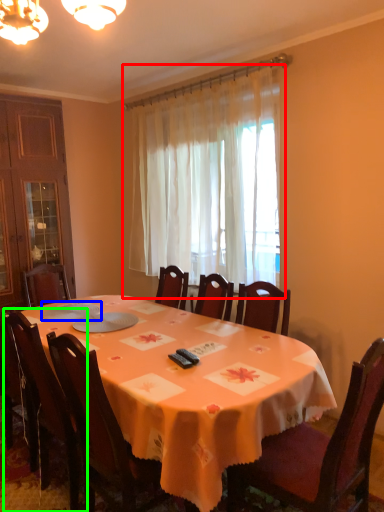
Question: Considering the real-world distances, which object is farthest from curtain (highlighted by a red box)? tableware (highlighted by a blue box) or chair (highlighted by a green box)?

Choices:
 (A) tableware
 (B) chair

Answer: (B)